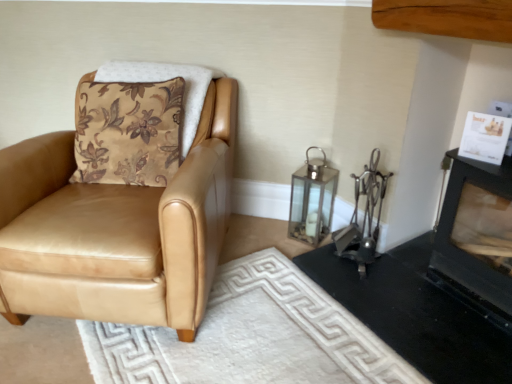
At what (x,y) coordinates should I click in order to perform the action: click on free region under clear glass lantern at center-right (from a real-world perspective). Please return your answer as a coordinate pair (x, y). Image resolution: width=512 pixels, height=384 pixels. Looking at the image, I should click on (306, 235).